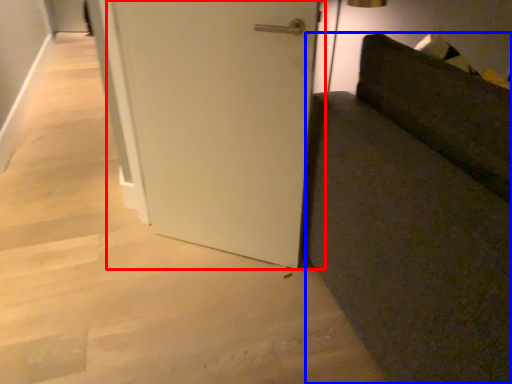
Question: Which of the following is the farthest to the observer, door (highlighted by a red box) or furniture (highlighted by a blue box)?

Choices:
 (A) door
 (B) furniture

Answer: (A)